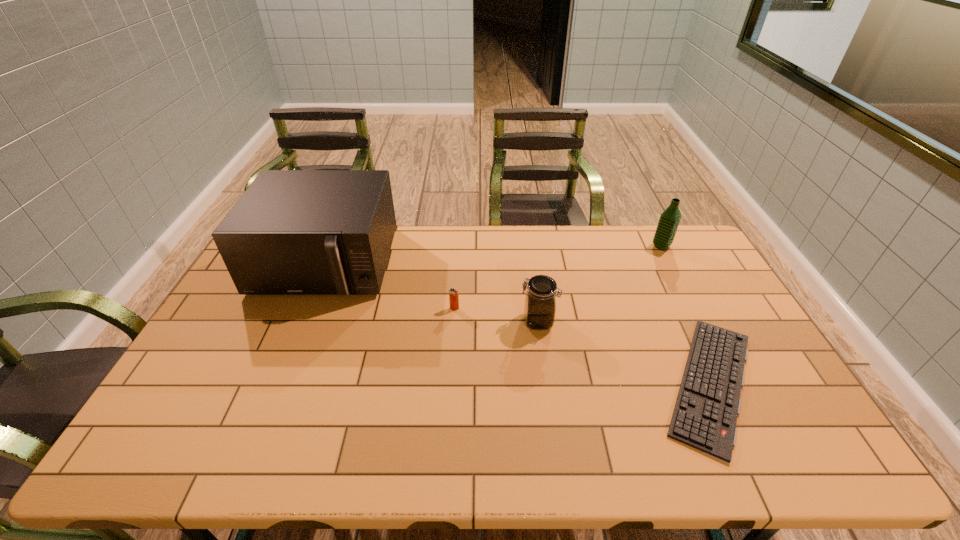
The image size is (960, 540). Find the location of `the closest object to the third shortest object`. the closest object to the third shortest object is located at coordinates (453, 293).

Where is `vacant space that satisfies the following two spatial constraints: 1. on the lid of the third object from left to right; 2. on the back side of the shortest object`? vacant space that satisfies the following two spatial constraints: 1. on the lid of the third object from left to right; 2. on the back side of the shortest object is located at coordinates (546, 383).

Find the location of a particular element. vacant point that satisfies the following two spatial constraints: 1. on the lid of the computer keyboard; 2. on the right side of the jar is located at coordinates (546, 383).

At what (x,y) coordinates should I click in order to perform the action: click on free location that satisfies the following two spatial constraints: 1. on the lid of the third tallest object; 2. on the back side of the computer keyboard. Please return your answer as a coordinate pair (x, y). Looking at the image, I should click on (546, 383).

Where is `free space that satisfies the following two spatial constraints: 1. on the back side of the second tallest object; 2. on the right side of the computer keyboard`? The image size is (960, 540). free space that satisfies the following two spatial constraints: 1. on the back side of the second tallest object; 2. on the right side of the computer keyboard is located at coordinates (646, 246).

Locate an element on the screen. The width and height of the screenshot is (960, 540). vacant space that satisfies the following two spatial constraints: 1. on the lid of the third tallest object; 2. on the left side of the computer keyboard is located at coordinates (546, 383).